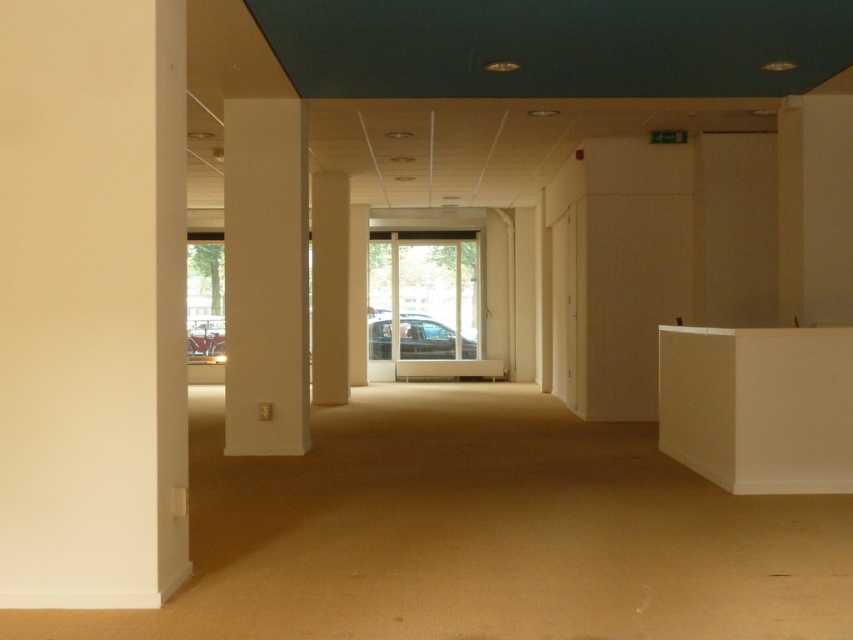
Question: Which point is farther to the camera?

Choices:
 (A) (329, 326)
 (B) (740, 481)
 (C) (378, 330)

Answer: (C)

Question: Is white matte reception desk at right wider than metallic silver car at center?

Choices:
 (A) yes
 (B) no

Answer: (B)

Question: Which point appears closest to the camera in this image?

Choices:
 (A) (245, 336)
 (B) (328, 236)
 (C) (839, 396)
 (D) (376, 316)

Answer: (C)

Question: Observing the image, what is the correct spatial positioning of white matte reception desk at right in reference to metallic silver car at center?

Choices:
 (A) below
 (B) above

Answer: (A)

Question: Which point is farther to the camera?

Choices:
 (A) (263, 365)
 (B) (317, 348)

Answer: (B)

Question: Is white glossy pillar at center smaller than metallic silver car at center?

Choices:
 (A) no
 (B) yes

Answer: (B)